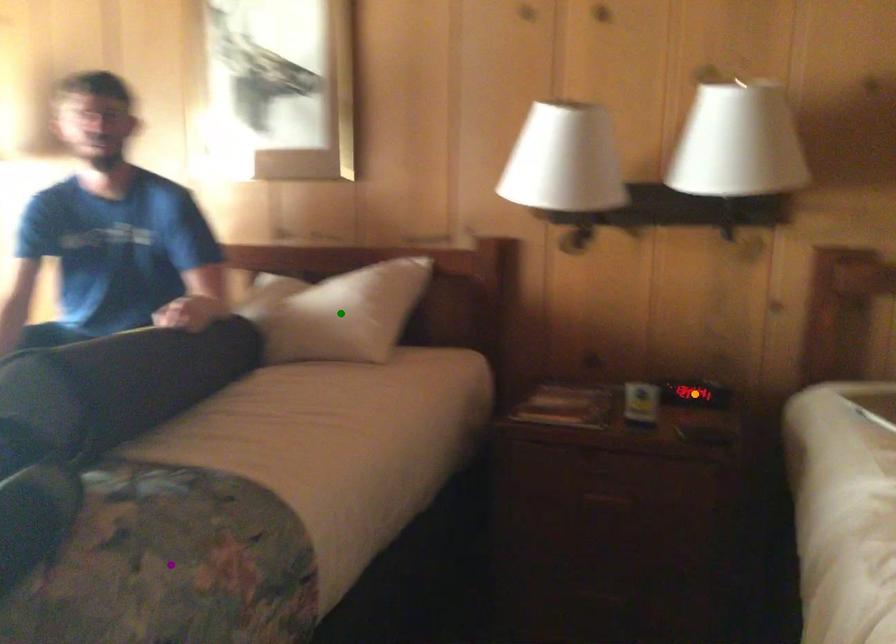
Order these from nearest to farthest:
A) purple point
B) green point
C) orange point

purple point < orange point < green point